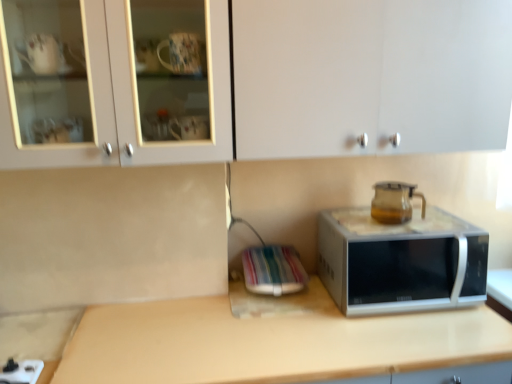
Where is `free spot below white glossy cabinet at upper center (from a real-world perspective)`? The width and height of the screenshot is (512, 384). free spot below white glossy cabinet at upper center (from a real-world perspective) is located at coordinates (216, 322).